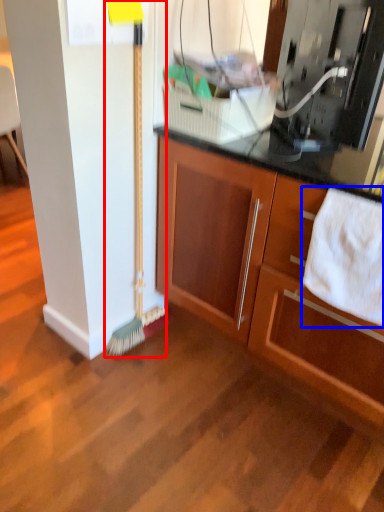
Question: Which object appears closest to the camera in this image, brush (highlighted by a red box) or bath towel (highlighted by a blue box)?

Choices:
 (A) brush
 (B) bath towel

Answer: (B)